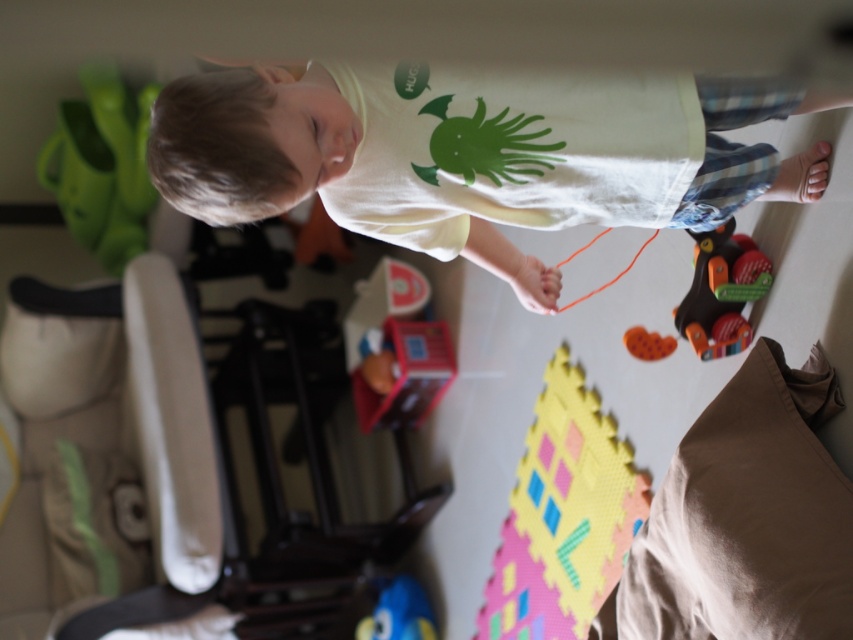
Is beige soft pillow at lower right below orange string at lower center?

Indeed, beige soft pillow at lower right is positioned under orange string at lower center.

Find the location of a particular element. beige soft pillow at lower right is located at coordinates (747, 516).

The width and height of the screenshot is (853, 640). What do you see at coordinates (747, 516) in the screenshot?
I see `beige soft pillow at lower right` at bounding box center [747, 516].

Image resolution: width=853 pixels, height=640 pixels. Find the location of `beige soft pillow at lower right`. beige soft pillow at lower right is located at coordinates coord(747,516).

Who is more distant from viewer, (645, 508) or (637, 355)?

The point (645, 508) is more distant.

Does rubberized foam puzzle piece at lower center have a lesser height compared to orange rubber toy at lower center?

No.

Locate an element on the screen. Image resolution: width=853 pixels, height=640 pixels. rubberized foam puzzle piece at lower center is located at coordinates (563, 516).

The image size is (853, 640). I want to click on rubberized foam puzzle piece at lower center, so click(563, 516).

Which is more to the right, beige soft pillow at lower right or orange rubber toy at lower center?

From the viewer's perspective, beige soft pillow at lower right appears more on the right side.

Between beige soft pillow at lower right and orange rubber toy at lower center, which one has less height?

With less height is orange rubber toy at lower center.

Where is `beige soft pillow at lower right`? This screenshot has height=640, width=853. beige soft pillow at lower right is located at coordinates (747, 516).

Where is `beige soft pillow at lower right`? The height and width of the screenshot is (640, 853). beige soft pillow at lower right is located at coordinates (747, 516).